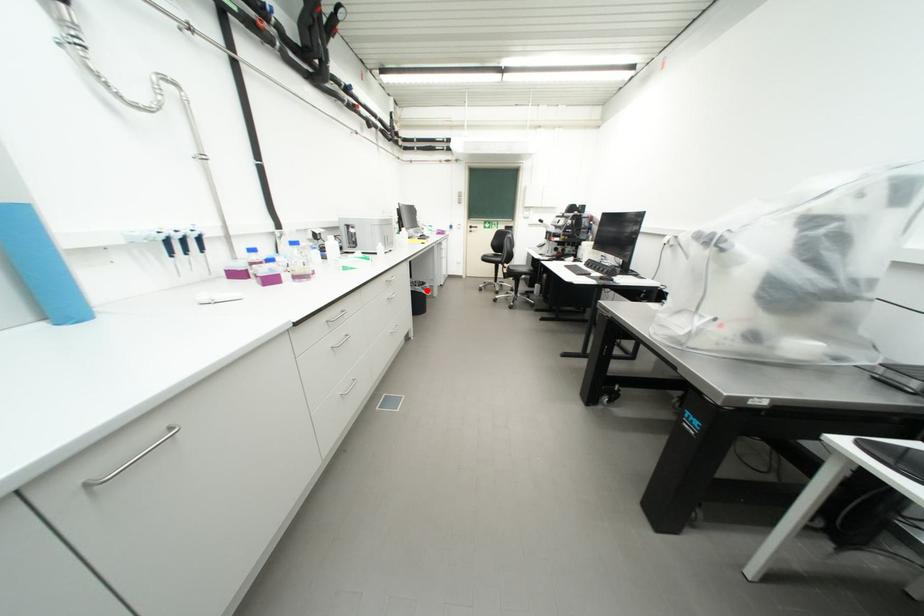
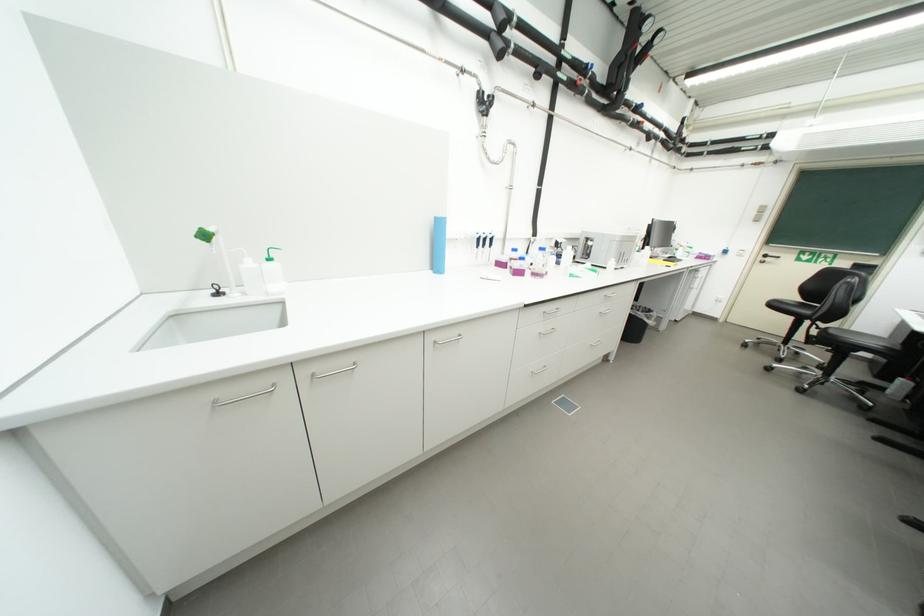
Find the pixel in the second image that matches the highlighted location in the first image.

(649, 317)